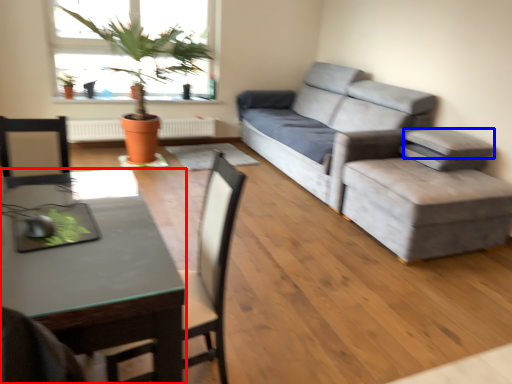
Question: Which point is closer to the camera, desk (highlighted by a red box) or pillow (highlighted by a blue box)?

Choices:
 (A) desk
 (B) pillow

Answer: (A)